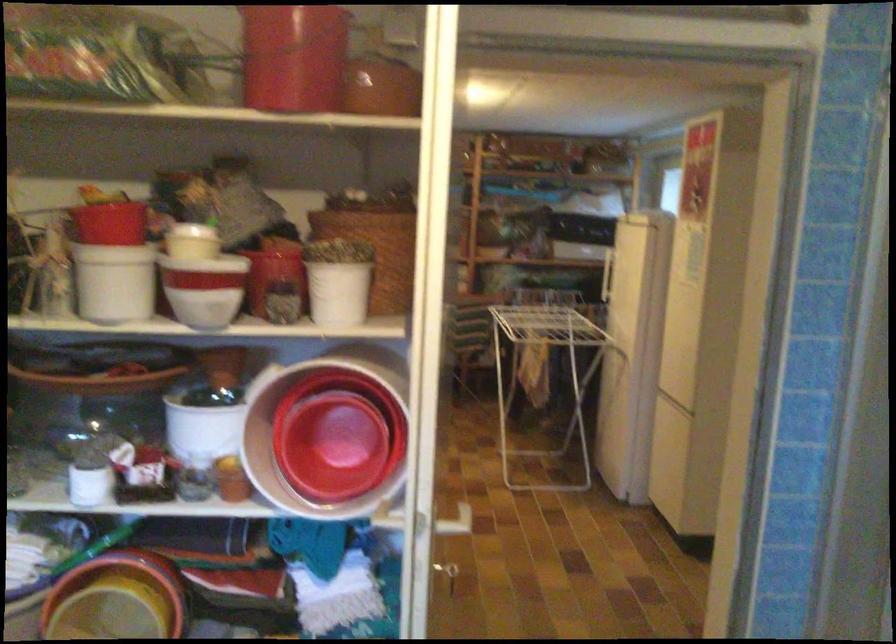
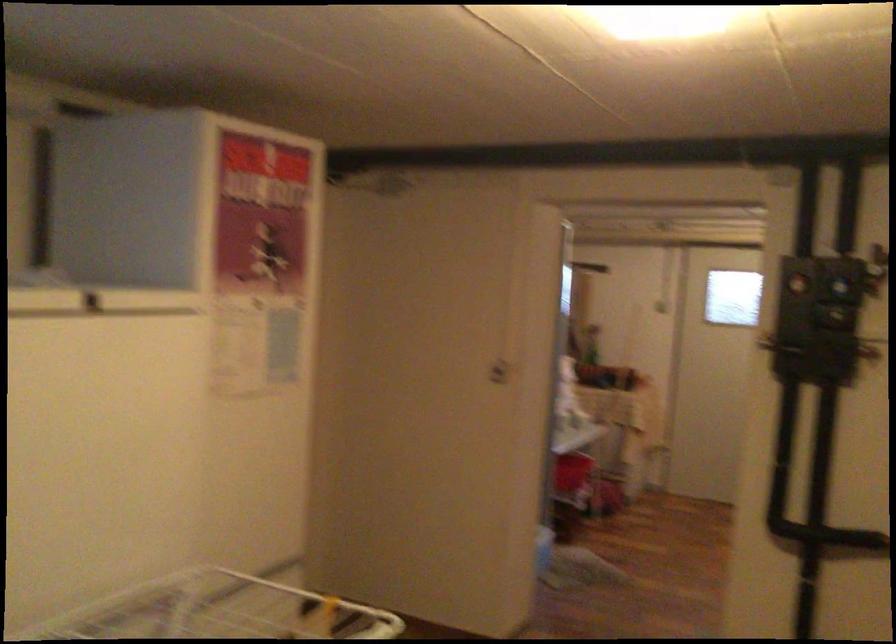
Question: I am providing you with two images of the same scene from different viewpoints. After the viewpoint changes to image2, which objects are now occluded?

Choices:
 (A) glass champagne flute
 (B) blue control dial
 (C) white plastic container
 (D) refrigerator door handle

Answer: (C)